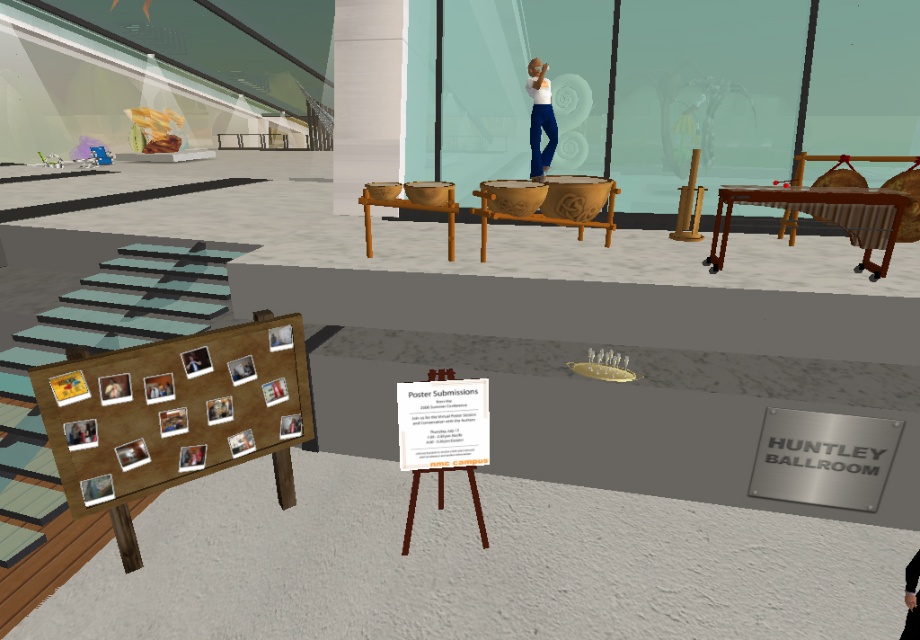
Who is more distant from viewer, (271, 356) or (900, 636)?

Result: The point (271, 356) is behind.

Who is positioned more to the left, wooden board at lower left or dark gray sweater at center?

From the viewer's perspective, wooden board at lower left appears more on the left side.

This screenshot has width=920, height=640. Find the location of `wooden board at lower left`. wooden board at lower left is located at coordinates (174, 413).

Is wooden board at lower left to the right of wooden bowls at center from the viewer's perspective?

No, wooden board at lower left is not to the right of wooden bowls at center.

Can you confirm if wooden board at lower left is bigger than wooden bowls at center?

Correct, wooden board at lower left is larger in size than wooden bowls at center.

Does point (158, 388) come behind point (370, 250)?

No.

You are a GUI agent. You are given a task and a screenshot of the screen. Output one action in this format:
    pyautogui.click(x=<x>, y=<y>)
    Task: Click on the wooden board at lower left
    
    Given the screenshot: What is the action you would take?
    pyautogui.click(x=174, y=413)

Is wooden marimba at center closer to the viewer compared to wooden bowls at center?

Yes.

Which is in front, point (851, 202) or point (453, 243)?

Point (851, 202) is more forward.

Find the location of a particular element. wooden marimba at center is located at coordinates (823, 218).